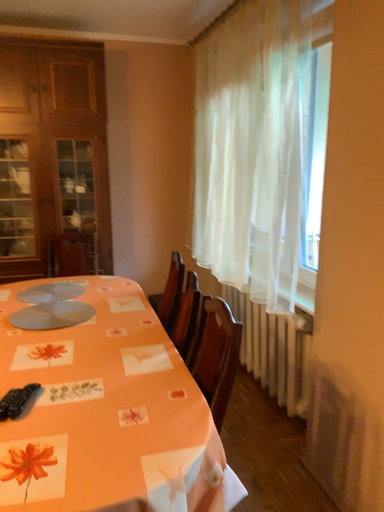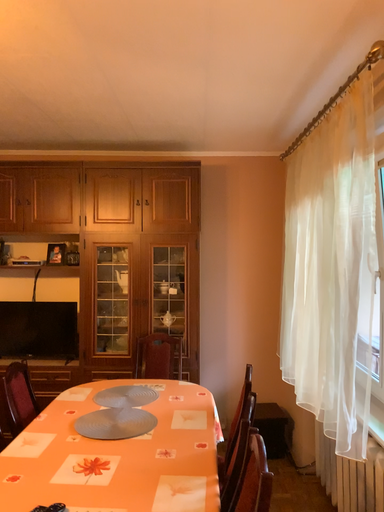
Question: How did the camera likely rotate when shooting the video?

Choices:
 (A) rotated left
 (B) rotated right

Answer: (A)